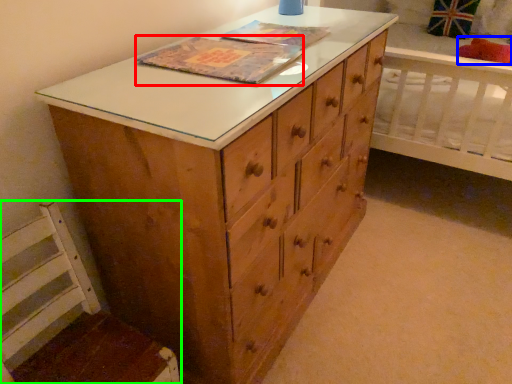
Question: Based on their relative distances, which object is nearer to book cover (highlighted by a red box)? Choose from pillow (highlighted by a blue box) and swivel chair (highlighted by a green box).

Choices:
 (A) pillow
 (B) swivel chair

Answer: (B)